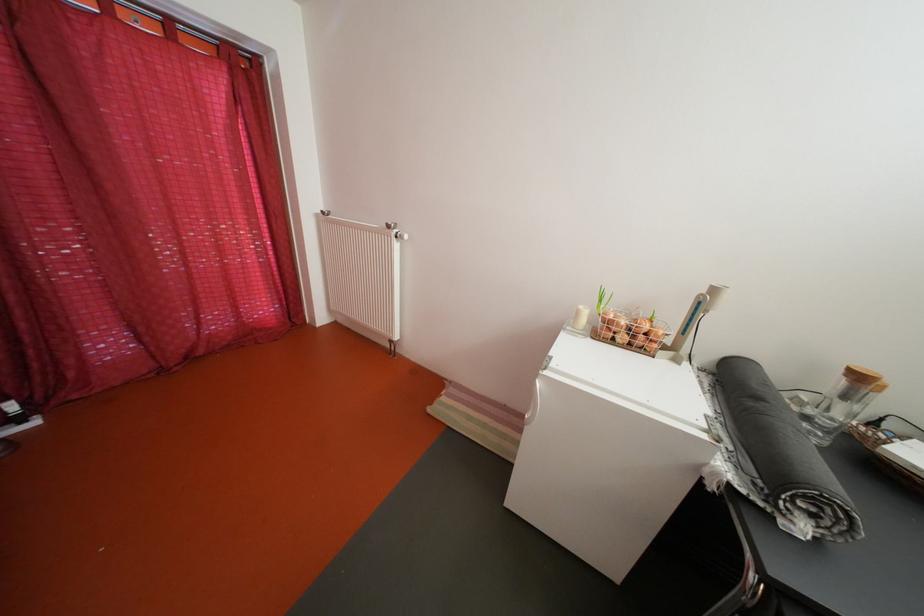
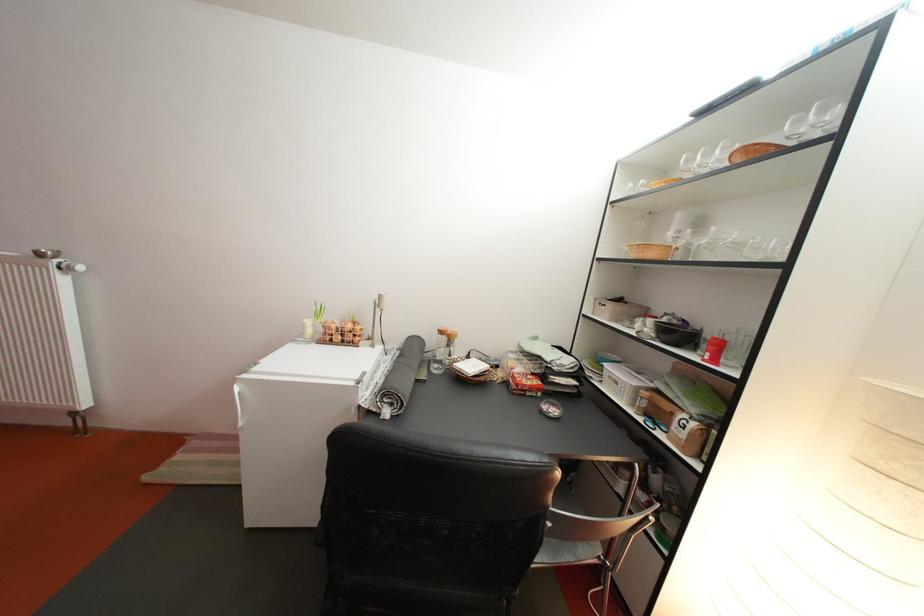
Find the pixel in the second image that matches point (869, 383) in the first image.

(453, 339)